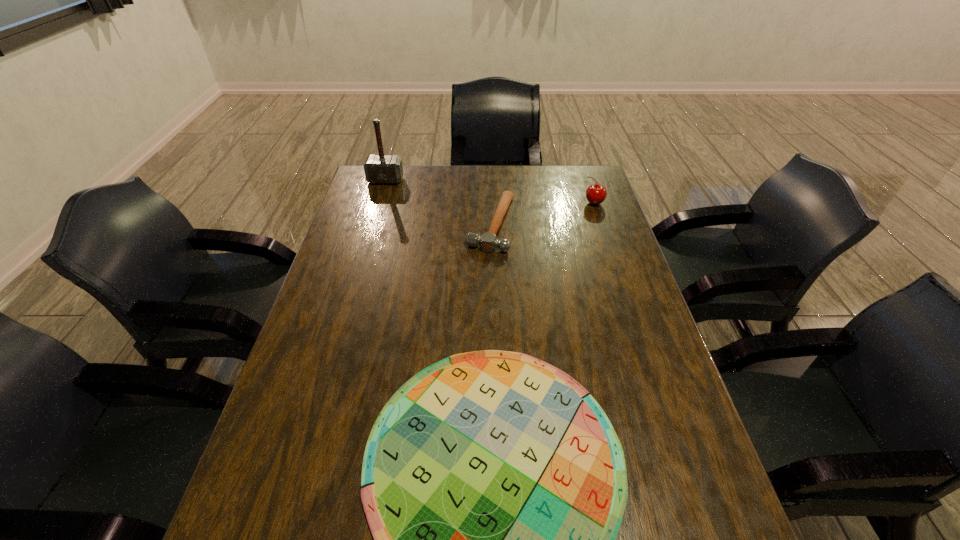
The image size is (960, 540). In order to click on object that is positioned at the left edge in this screenshot , I will do `click(379, 169)`.

Find the location of `object situated at the right edge`. object situated at the right edge is located at coordinates (595, 193).

Image resolution: width=960 pixels, height=540 pixels. Identify the location of object situated at the far left corner. (379, 169).

Identify the location of object that is at the far right corner. This screenshot has width=960, height=540. (595, 193).

This screenshot has width=960, height=540. In the image, there is a desktop. Find the location of `free space at the far edge`. free space at the far edge is located at coordinates (516, 175).

Locate an element on the screen. The image size is (960, 540). vacant space at the left edge of the desktop is located at coordinates (321, 354).

Where is `free space at the right edge of the desktop`? free space at the right edge of the desktop is located at coordinates (633, 284).

Where is `vacant space at the far right corner of the desktop`? The image size is (960, 540). vacant space at the far right corner of the desktop is located at coordinates (557, 172).

The image size is (960, 540). I want to click on free point between the nearer hammer and the farther hammer, so click(x=439, y=202).

Where is `empty space that is in between the farthest object and the nearer hammer`? empty space that is in between the farthest object and the nearer hammer is located at coordinates (439, 202).